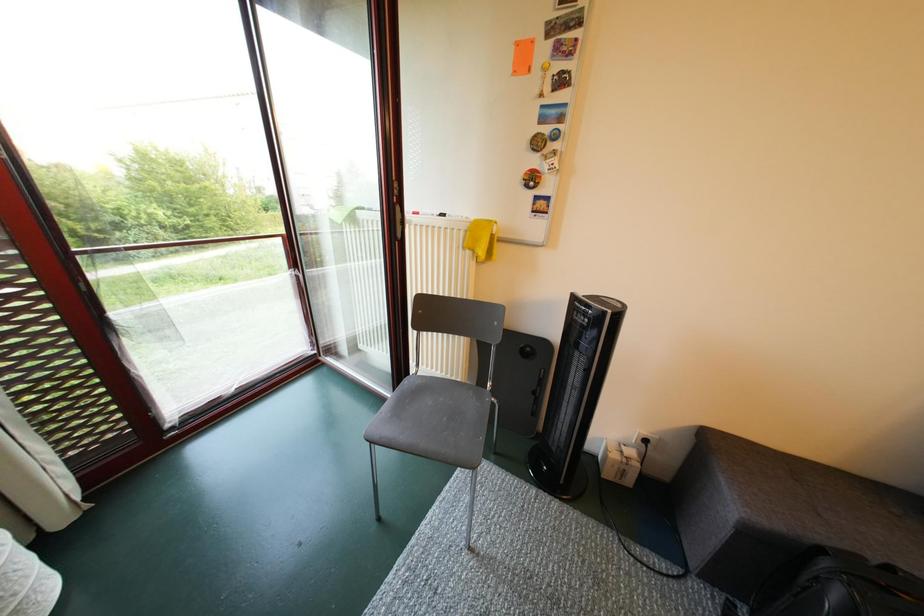
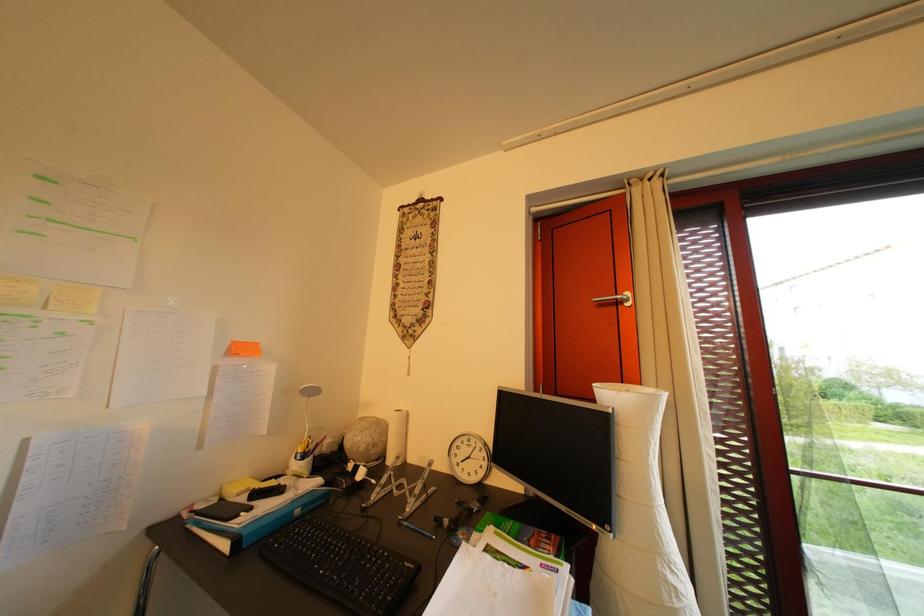
Question: Based on the continuous images, in which direction is the camera rotating? Reply with the corresponding letter.

Choices:
 (A) Left
 (B) Right
 (C) Up
 (D) Down

Answer: (A)